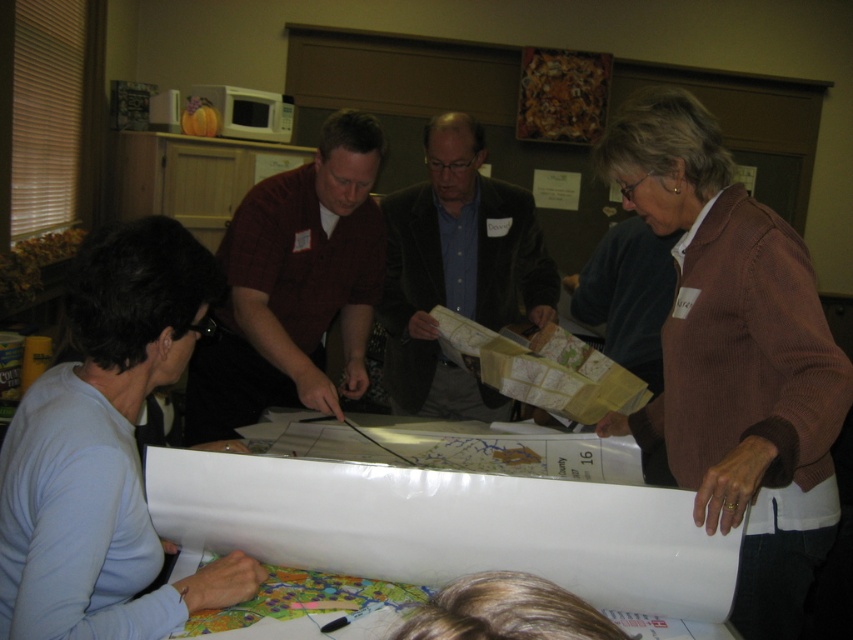
Does brown corduroy sweater at upper right come in front of light blue fabric at lower left?

No, brown corduroy sweater at upper right is behind light blue fabric at lower left.

From the picture: Does brown corduroy sweater at upper right have a lesser width compared to light blue fabric at lower left?

In fact, brown corduroy sweater at upper right might be wider than light blue fabric at lower left.

Is point (819, 310) less distant than point (18, 636)?

No, it is not.

This screenshot has width=853, height=640. In order to click on brown corduroy sweater at upper right in this screenshot , I will do `click(734, 356)`.

Between white paper at center and velvet brown jacket at center, which one is positioned lower?

white paper at center is lower down.

Measure the distance between point (x=550, y=566) and camera.

They are 1.21 meters apart.

In order to click on white paper at center in this screenshot , I will do `click(456, 518)`.

Who is higher up, light blue fabric at lower left or velvet brown jacket at center?

velvet brown jacket at center is higher up.

Measure the distance between point (190, 288) and camera.

Point (190, 288) is 1.20 meters away from camera.

Between point (48, 452) and point (491, 300), which one is positioned in front?

Point (48, 452)

The width and height of the screenshot is (853, 640). I want to click on light blue fabric at lower left, so click(x=105, y=451).